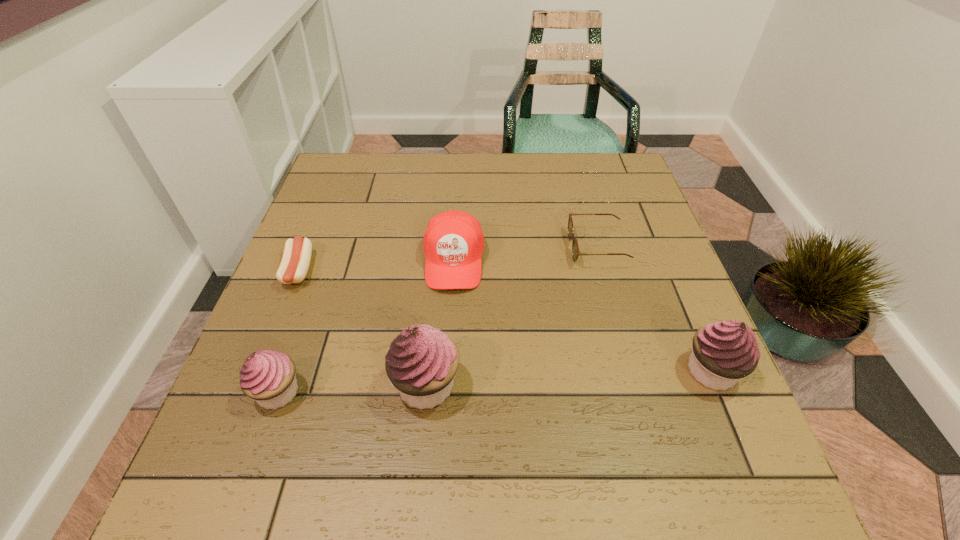
Where is `object at the near right corner`? object at the near right corner is located at coordinates (724, 352).

You are a GUI agent. You are given a task and a screenshot of the screen. Output one action in this format:
    pyautogui.click(x=<x>, y=<y>)
    Task: Click on the free location at the far edge of the desktop
    The height and width of the screenshot is (540, 960).
    Given the screenshot: What is the action you would take?
    pyautogui.click(x=555, y=177)

Where is `free space at the near edge`? This screenshot has width=960, height=540. free space at the near edge is located at coordinates (624, 414).

This screenshot has width=960, height=540. In order to click on vacant space at the left edge in this screenshot , I will do `click(324, 234)`.

I want to click on vacant region at the right edge of the desktop, so click(638, 385).

Identify the location of free point at the far left corner. pos(357,174).

You are a GUI agent. You are given a task and a screenshot of the screen. Output one action in this format:
    pyautogui.click(x=<x>, y=<y>)
    Task: Click on the vacant space at the far right corner
    The height and width of the screenshot is (540, 960).
    Given the screenshot: What is the action you would take?
    pyautogui.click(x=612, y=183)

Identify the location of unoccupied position between the second cupcake from left to right and the shortest cupcake. tap(352, 388).

Locate an element on the screen. This screenshot has width=960, height=540. free space between the second tallest cupcake and the second cupcake from right to left is located at coordinates (568, 378).

At what (x,y) coordinates should I click in order to perform the action: click on unoccupied position between the sausage and the second cupcake from left to right. Please return your answer as a coordinate pair (x, y). The image size is (960, 540). Looking at the image, I should click on (362, 328).